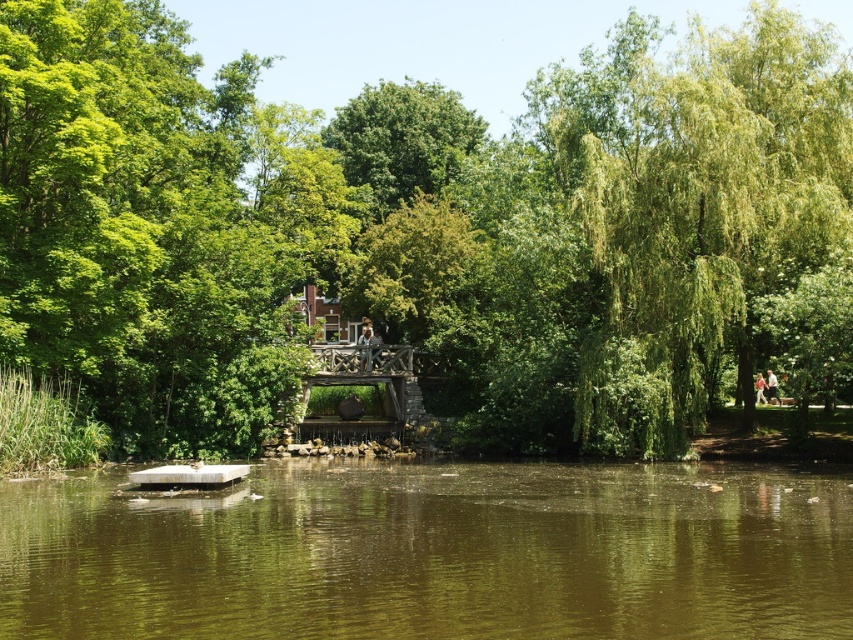
You are a bird looking for a place to perch. You see the green leafy tree at center and the brown murky water at center. Which one is taller and would be a better spot to land?

The green leafy tree at center is taller than the brown murky water at center, so it would be a better spot to land.

You are standing in the park and want to take a photo of both the point at coordinates point (289, 355) and point (39, 524). Which point will appear closer to the camera in your photo?

Point (39, 524) will appear closer to the camera in the photo because it is physically closer to the camera than point (289, 355), which is further away.

You are a park visitor standing at the edge of the pond. You see the green leafy tree at center and the brown murky water at center. Which object is closer to you?

The green leafy tree at center is closer to you because the brown murky water at center is behind it.